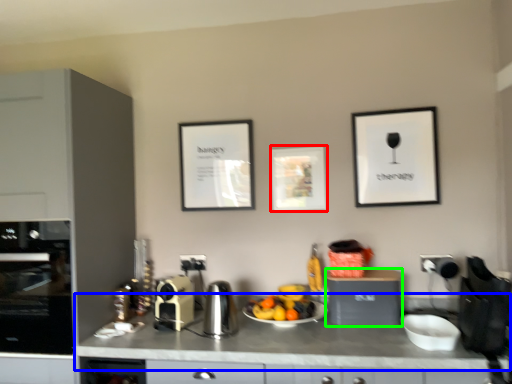
Question: Based on their relative distances, which object is farther from picture frame (highlighted by a red box)? Choose from countertop (highlighted by a blue box) and cabinetry (highlighted by a green box).

Choices:
 (A) countertop
 (B) cabinetry

Answer: (A)